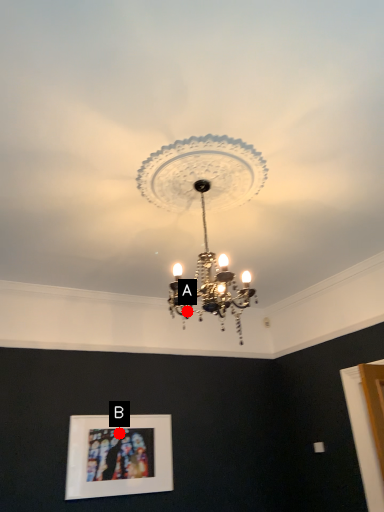
Question: Two points are circled on the image, labeled by A and B beside each circle. Which of the following is the closest to the observer?

Choices:
 (A) A is closer
 (B) B is closer

Answer: (A)